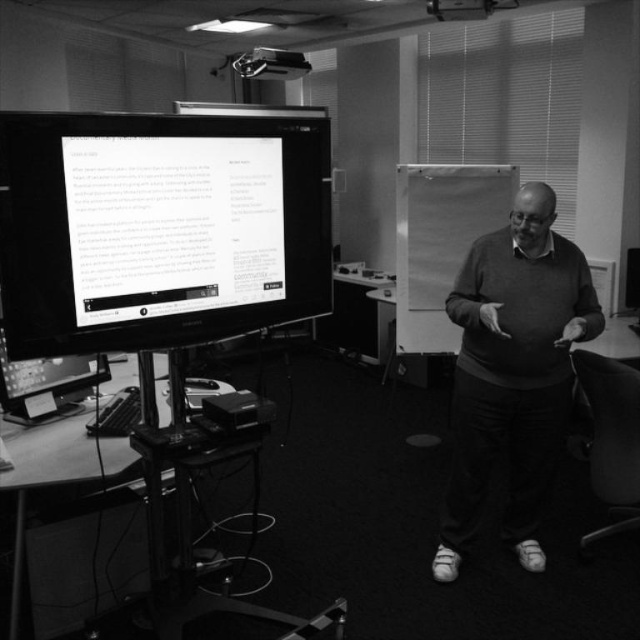
Is point (451, 561) closer to viewer compared to point (632, 465)?

No, it is not.

This screenshot has height=640, width=640. Find the location of `matte sweater at center`. matte sweater at center is located at coordinates (513, 372).

Is matte black monitor at left bigger than matte sweater at center?

Incorrect, matte black monitor at left is not larger than matte sweater at center.

Who is more forward, (296,276) or (460,468)?

Positioned in front is point (296,276).

Measure the distance between point (90, 161) and camera.

They are 1.79 meters apart.

Find the location of a particular element. The height and width of the screenshot is (640, 640). matte black monitor at left is located at coordinates (161, 227).

Find the location of a particular element. The width and height of the screenshot is (640, 640). matte black monitor at left is located at coordinates (161, 227).

Is matte black monitor at left bigger than smooth plastic swivel chair at lower right?

Correct, matte black monitor at left is larger in size than smooth plastic swivel chair at lower right.

Does point (250, 202) lie behind point (621, 522)?

No, it is not.

The width and height of the screenshot is (640, 640). I want to click on matte black monitor at left, so click(161, 227).